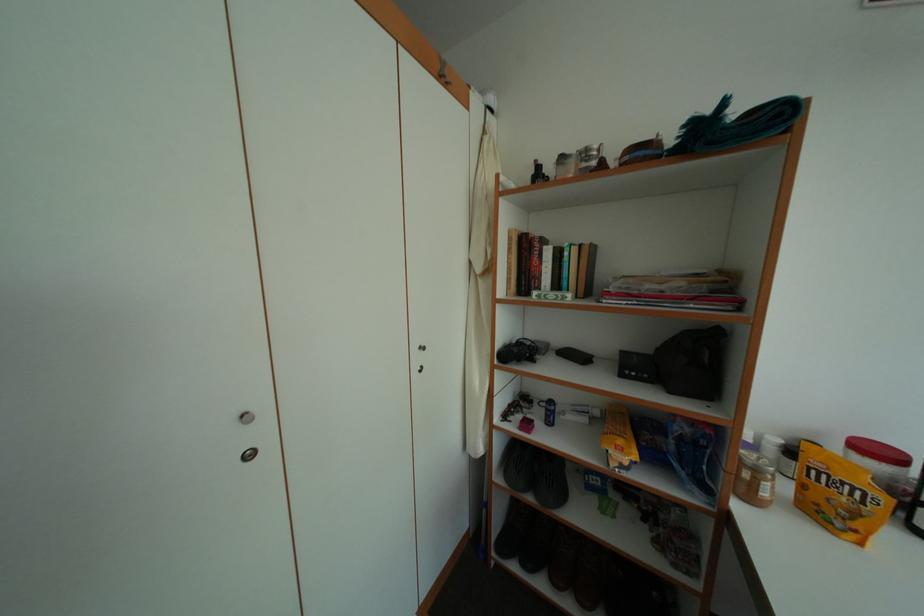
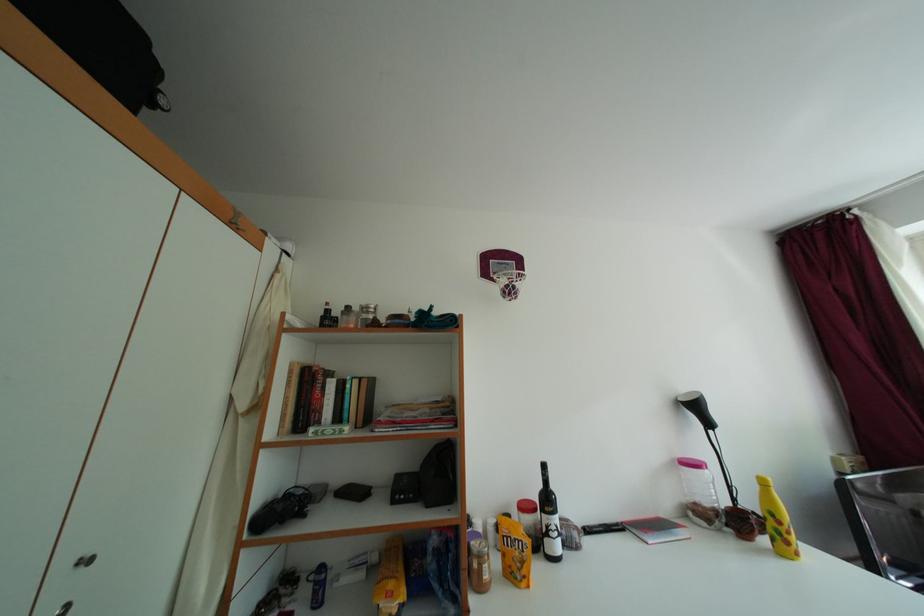
How did the camera likely rotate?

The camera rotated toward right-up.